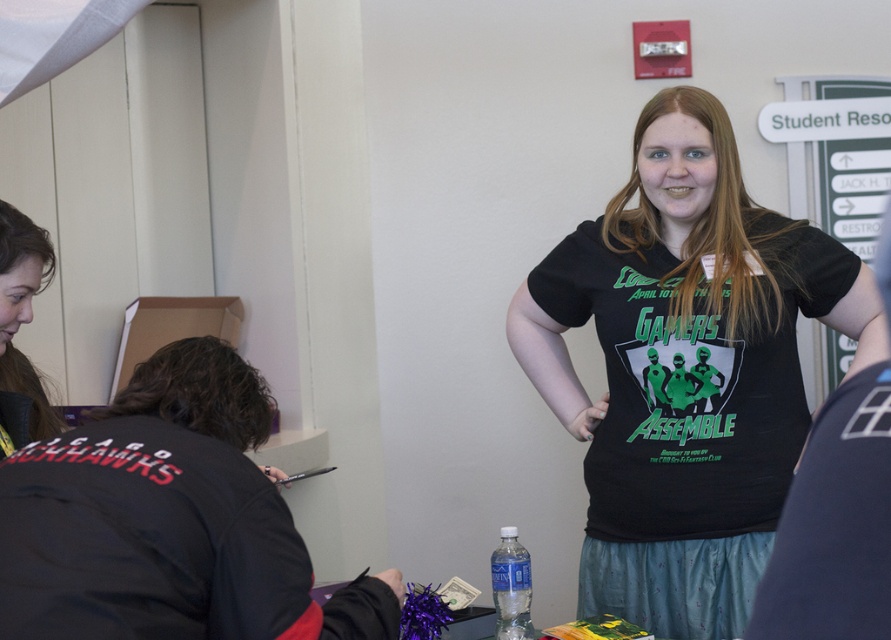
Question: Is black matte shirt at center to the right of brown hair at left from the viewer's perspective?

Choices:
 (A) no
 (B) yes

Answer: (B)

Question: Estimate the real-world distances between objects in this image. Which object is closer to the brown hair at left?

Choices:
 (A) black matte shirt at center
 (B) black matte t-shirt at center

Answer: (B)

Question: Can you confirm if black matte shirt at center is positioned above brown hair at left?

Choices:
 (A) yes
 (B) no

Answer: (A)

Question: Among these objects, which one is farthest from the camera?

Choices:
 (A) black matte shirt at center
 (B) brown hair at left
 (C) black matte t-shirt at center

Answer: (A)

Question: Which object is positioned closest to the black matte shirt at center?

Choices:
 (A) brown hair at left
 (B) black matte t-shirt at center

Answer: (B)

Question: Is black matte shirt at center below brown hair at left?

Choices:
 (A) no
 (B) yes

Answer: (A)